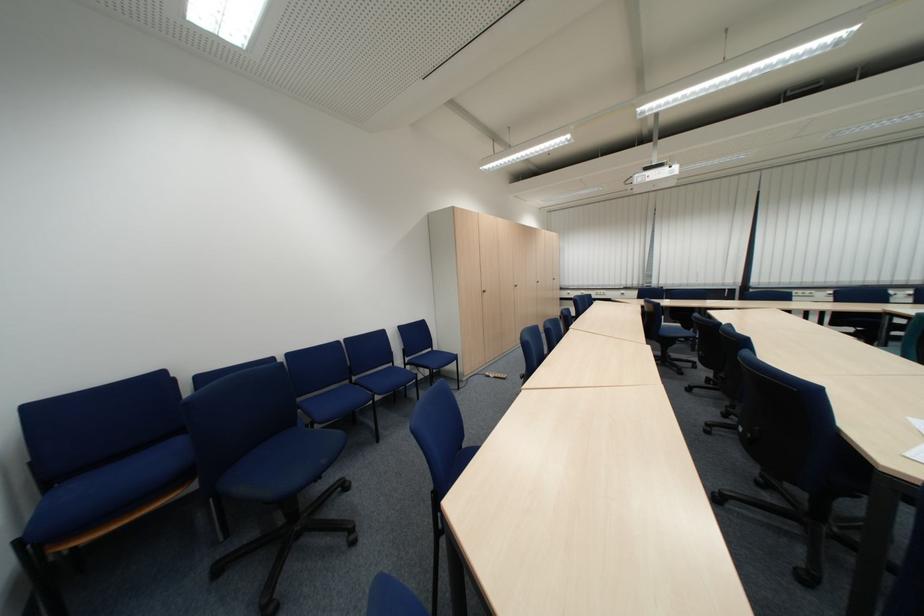
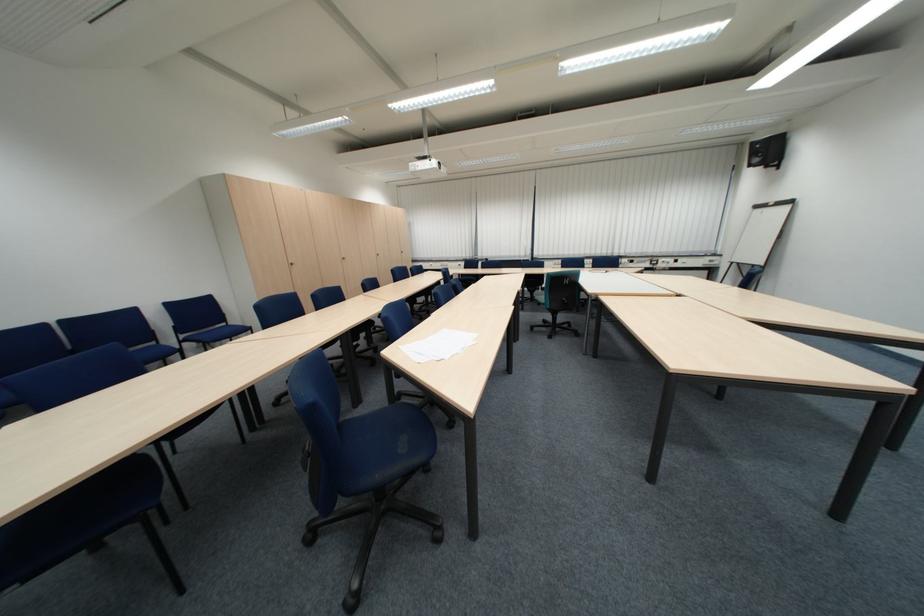
The images are taken continuously from a first-person perspective. In which direction are you moving?

The movement direction of the cameraman is right, backward.